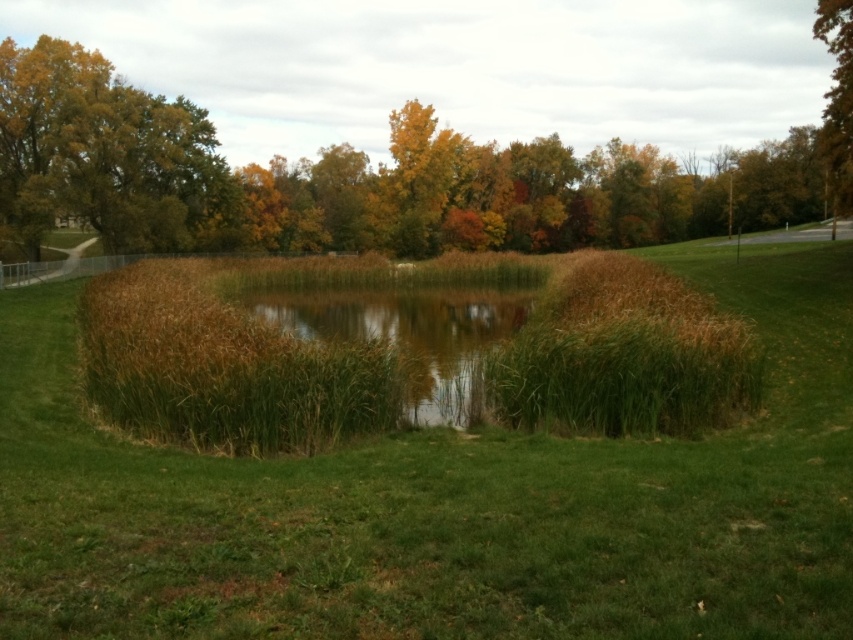
Question: Is green leafy tree at upper left wider than brown grassy lake at center?

Choices:
 (A) yes
 (B) no

Answer: (B)

Question: Can you confirm if green leafy tree at upper left is thinner than brown grassy lake at center?

Choices:
 (A) yes
 (B) no

Answer: (A)

Question: Estimate the real-world distances between objects in this image. Which object is closer to the brown grass at right?

Choices:
 (A) brown grassy lake at center
 (B) green leafy tree at upper left
 (C) green grassy golf course at center

Answer: (C)

Question: Estimate the real-world distances between objects in this image. Which object is closer to the brown grassy lake at center?

Choices:
 (A) green leafy tree at upper center
 (B) green leafy tree at upper left
 (C) brown grass at right
 (D) green grassy golf course at center

Answer: (D)

Question: Is green grassy golf course at center behind brown grass at right?

Choices:
 (A) yes
 (B) no

Answer: (B)

Question: Which point is closer to the camera taking this photo?

Choices:
 (A) (142, 163)
 (B) (815, 35)

Answer: (A)